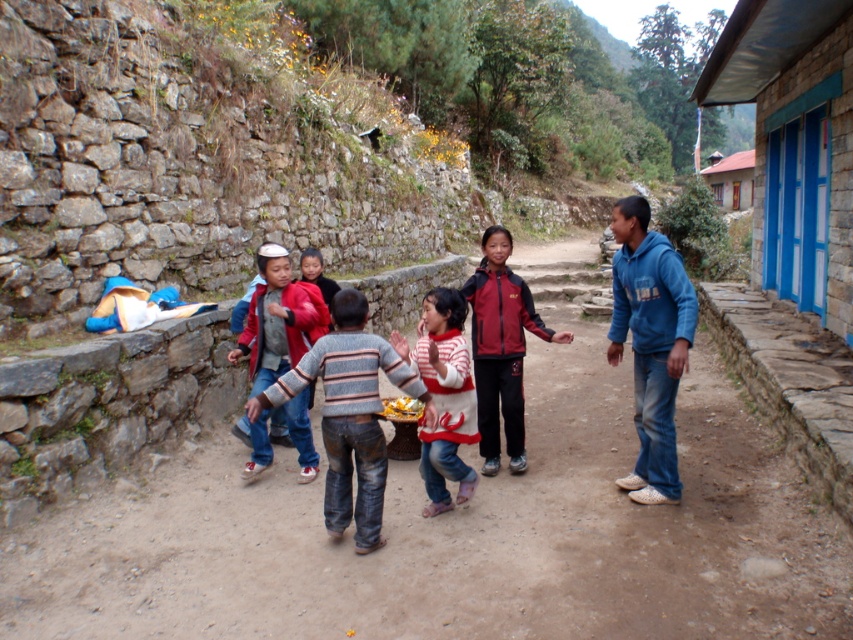
Question: Is maroon fabric jacket at center bigger than striped cotton sweater at center?

Choices:
 (A) no
 (B) yes

Answer: (B)

Question: Which point is closer to the camera taking this photo?

Choices:
 (A) (670, 440)
 (B) (805, 72)
 (C) (721, 170)

Answer: (A)

Question: Considering the relative positions of brown dirt track at center and striped sweater at center in the image provided, where is brown dirt track at center located with respect to striped sweater at center?

Choices:
 (A) below
 (B) above

Answer: (A)

Question: Which is nearer to the striped cotton sweater at center?

Choices:
 (A) maroon fabric jacket at center
 (B) red jacket at center

Answer: (A)

Question: Can you confirm if striped cotton sweater at center is bigger than red jacket at center?

Choices:
 (A) yes
 (B) no

Answer: (B)

Question: Which point is farther to the camera?

Choices:
 (A) (732, 205)
 (B) (598, 492)
 (C) (791, 264)

Answer: (A)